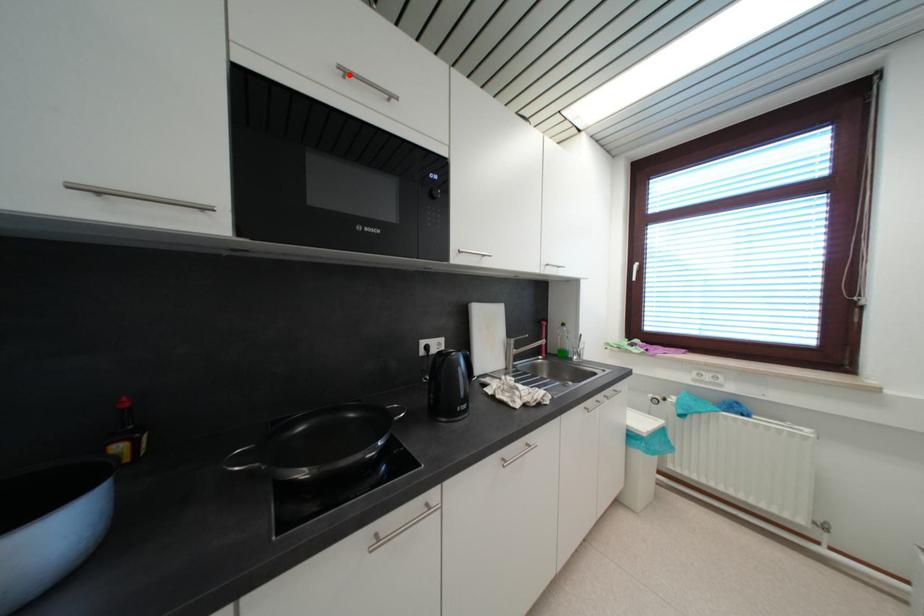
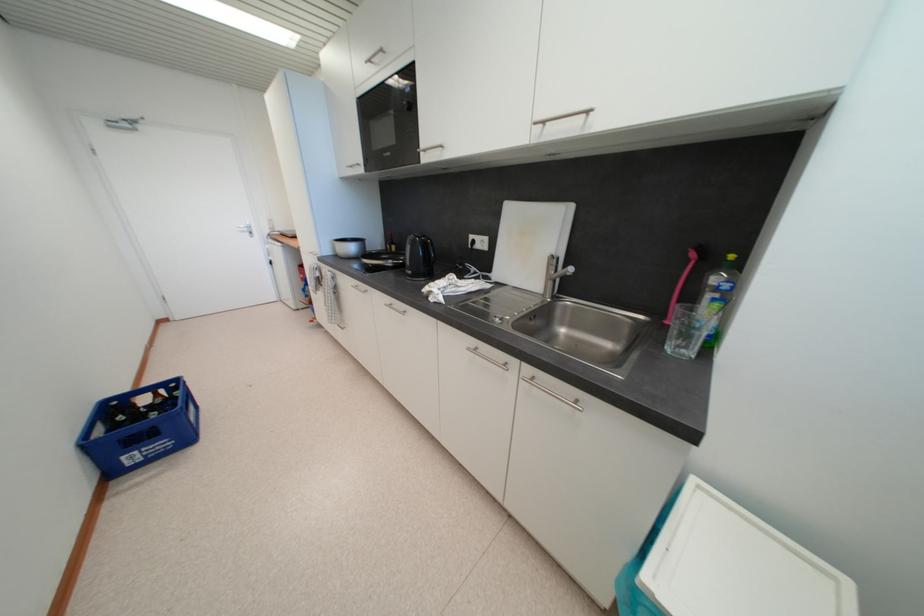
Where in the second image is the point corresponding to the highlighted location from the first image?

(375, 63)